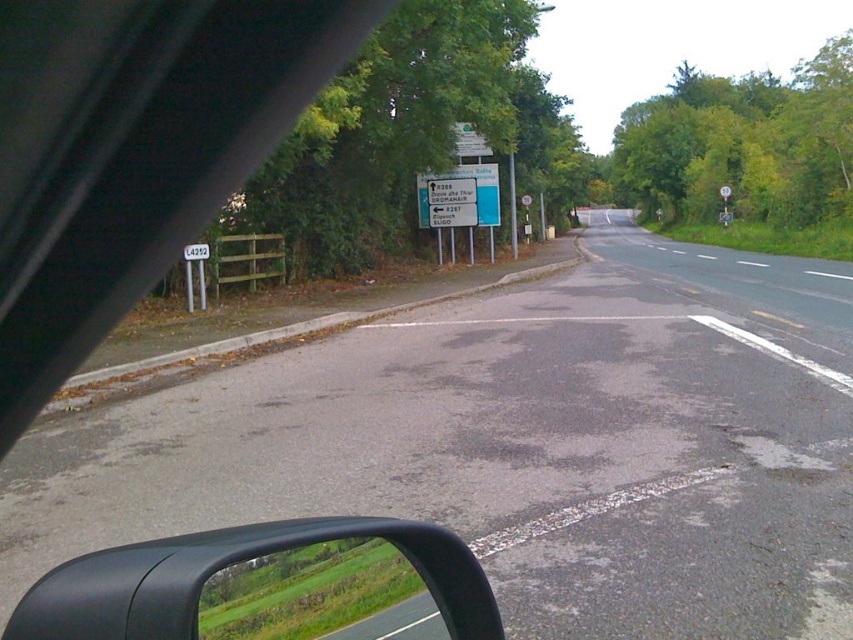
You are sitting in the driver seat of the vehicle and notice two points on the road ahead. The first point is at coordinates point (3, 636) and the second is at point (293, 580). Which point is closer to your current position?

Point (3, 636) is closer to the camera than point (293, 580), so the first point is closer to your current position.

You are driving a car and notice two objects in your view. The green matte side mirror at lower left and the white plastic sign at upper left. Which object is closer to you?

The green matte side mirror at lower left is closer to you because it has a smaller size compared to the white plastic sign at upper left.

You are a passenger in the car and you see two points on the road ahead. The first point is at coordinate point (263, 534) and the second is at point (192, 259). Which point is closer to you?

Point (263, 534) is closer to the viewer than point (192, 259).